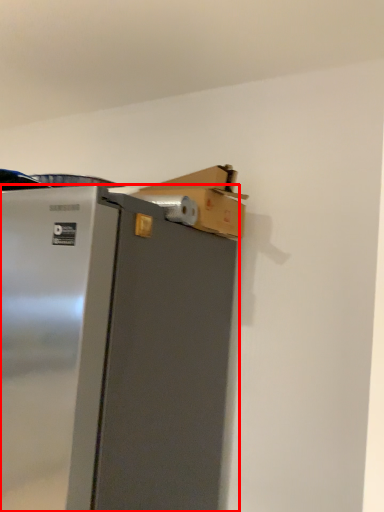
Question: From the image's perspective, considering the relative positions of refrigerator (annotated by the red box) and cardboard box in the image provided, where is refrigerator (annotated by the red box) located with respect to the staircase?

Choices:
 (A) below
 (B) above

Answer: (A)